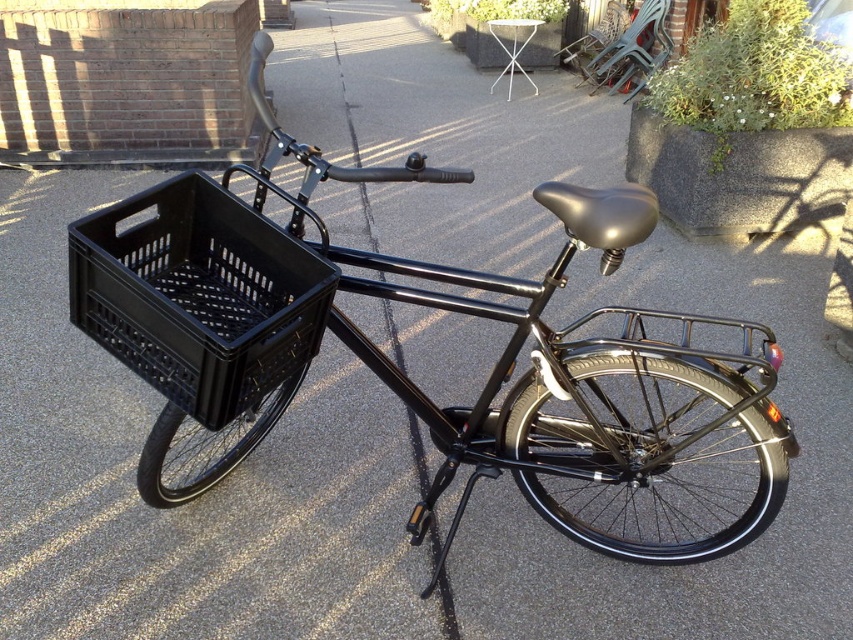
You are a delivery person who needs to load a package onto the black matte bicycle at center. The black plastic basket at left is already holding some items. Which object should you place the package on to ensure it stays stable?

The black matte bicycle at center is positioned on the right side of the black plastic basket at left. Since the black plastic basket at left is already holding items, placing the package on the black matte bicycle at center would provide a more stable placement due to its larger structure and the bike being positioned further right, away from the wall casting shadows.

You are standing at the origin point of the coordinate system where the brick wall is on the left and the concrete planter is on the right. You see the point at coordinate point [556,369]. What object is located at that point?

The black matte bicycle at center is located at point [556,369].

From the picture: You are standing at the camera position and want to approach the black matte bicycle at center. If your stride length is 2.3 feet per step, how many steps do you need to take to reach the bicycle?

The distance between you and the black matte bicycle at center is 4.65 feet. With each step covering 2.3 feet, you would need to take 2 steps to reach the bicycle since 2 steps multiplied by 2.3 feet equals 4.6 feet, which is just short of the total distance. However, rounding up, 3 steps would ensure you reach the bicycle.